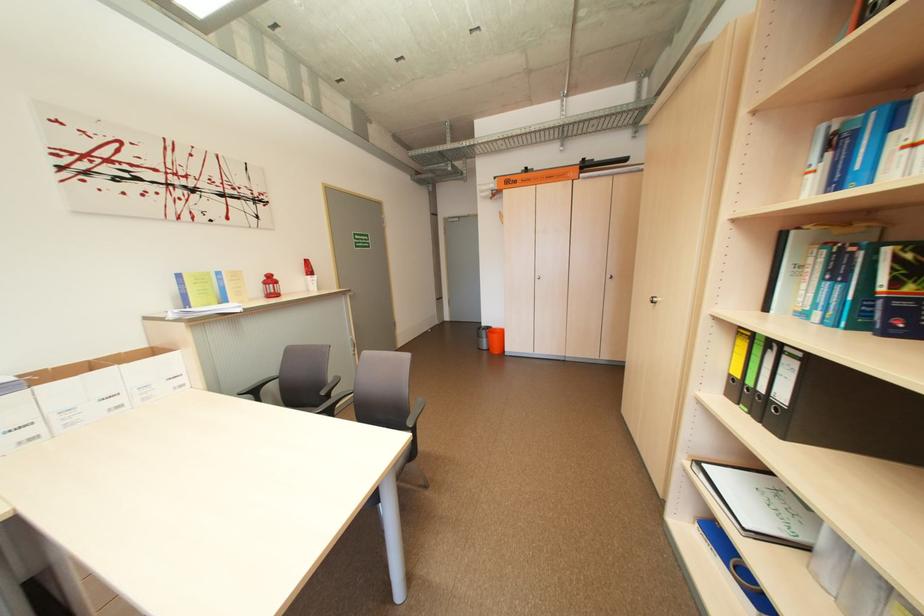
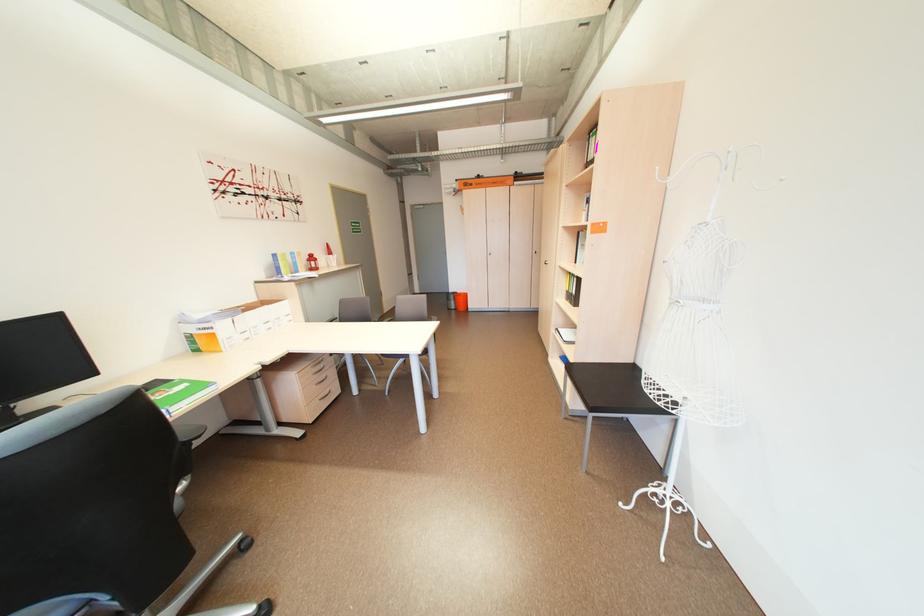
Locate, in the second image, the point that corresponds to (497,329) in the first image.

(464, 294)